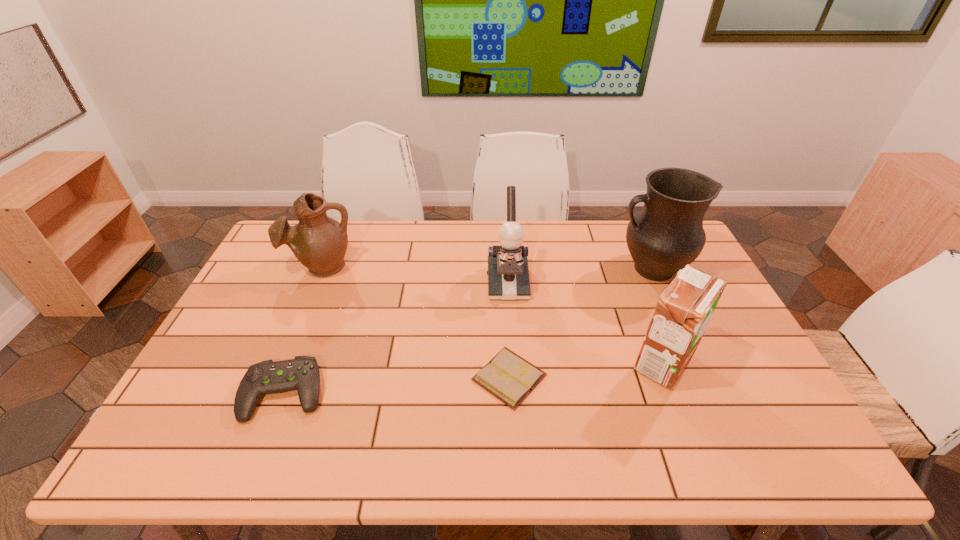
The image size is (960, 540). Find the location of `free location that satisfies the following two spatial constraints: 1. at the spout of the shorter pitcher; 2. on the right side of the control`. free location that satisfies the following two spatial constraints: 1. at the spout of the shorter pitcher; 2. on the right side of the control is located at coordinates (269, 393).